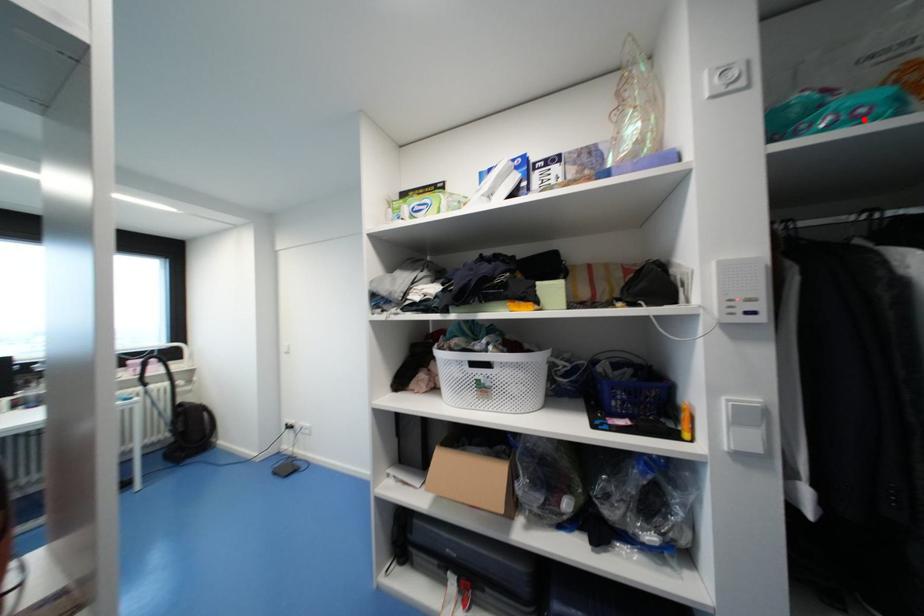
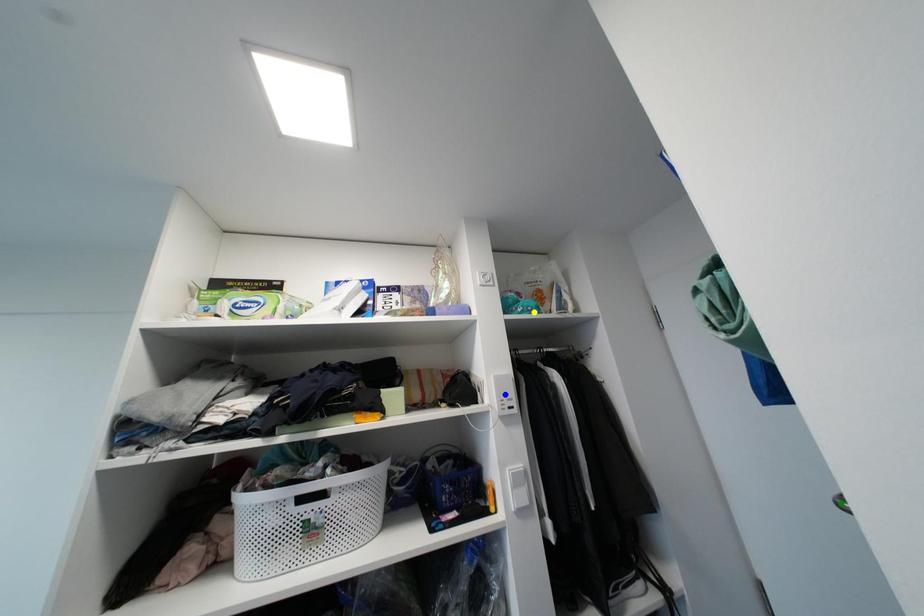
Question: I am providing you with two images of the same scene from different viewpoints. A red point is marked on the first image. You are given multiple points on the second image. In image 2, which mark is for the same physical point as the one in image 1?

Choices:
 (A) blue point
 (B) yellow point
 (C) green point

Answer: (B)